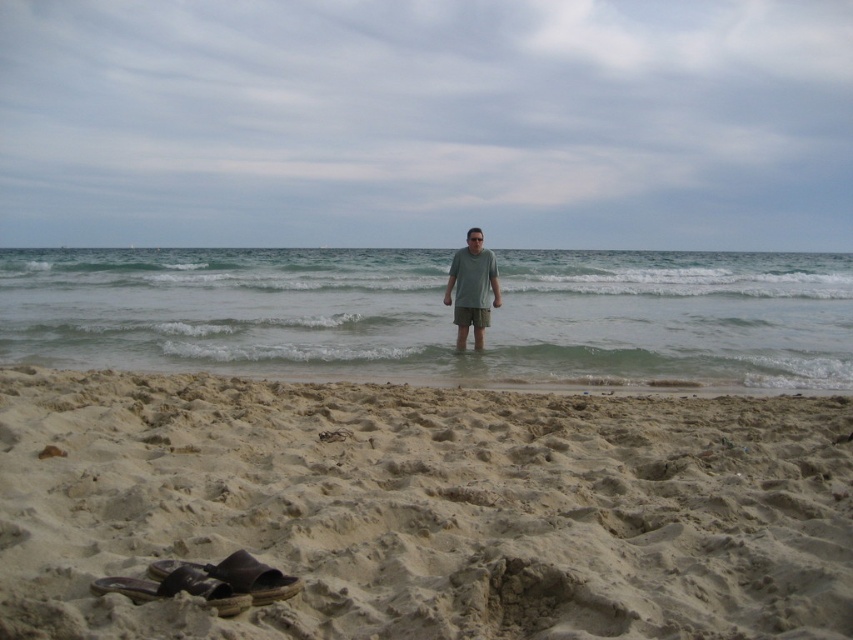
You are a photographer setting up a shot of the beach scene. You need to ensure that the matte gray shorts at center and the brown leather sandal at lower left are both in focus. Given their sizes, which object should you adjust your camera focus on first to ensure both are sharp?

The matte gray shorts at center is larger in size than the brown leather sandal at lower left, so you should focus on the matte gray shorts at center first as it is the larger object and requires more precise focus to maintain sharpness.

You are a lifeguard on duty and need to assess the swimming conditions. Based on the image, which object is wider, the clear water at center or the brown leather sandal at lower left?

The clear water at center might be wider than brown leather sandal at lower left according to the description.

You are standing at the edge of the ocean in the beach scene. You want to place a small flag exactly at the point labeled as point (424, 509). Based on the scene description, where would this flag be placed relative to the dark colored sandals?

The point (424, 509) corresponds to the light brown sandy beach at lower center, so the flag would be placed on the light brown sandy beach at lower center, which is near the dark colored sandals.